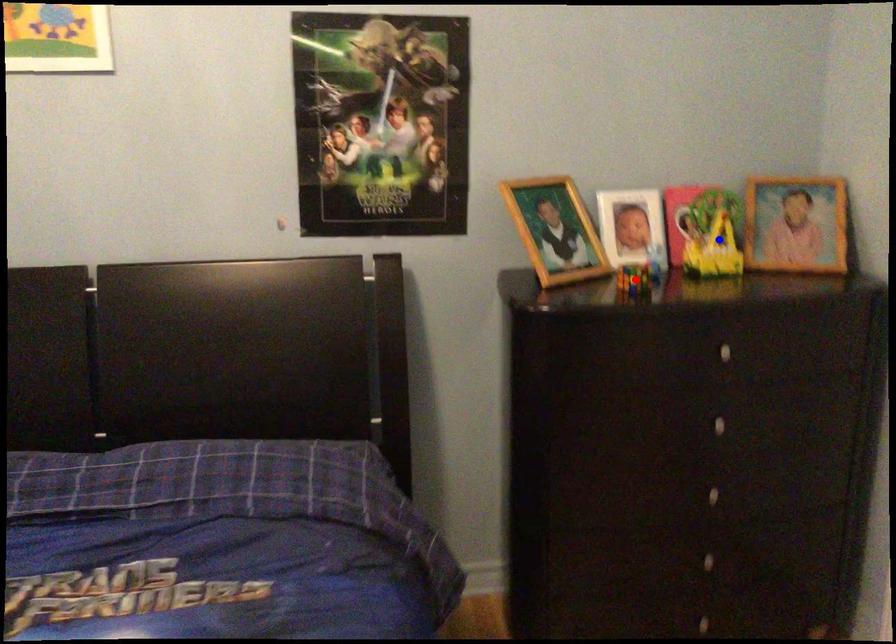
Question: Two points are marked on the image. Which point is closer to the camera?

Choices:
 (A) Blue point is closer.
 (B) Red point is closer.

Answer: (B)